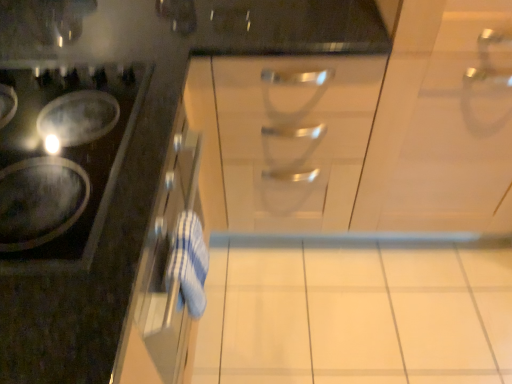
Question: Is shiny black cooktop at left to the left or to the right of white glossy cabinet at upper left, positioned as the first cabinetry in left-to-right order, in the image?

Choices:
 (A) right
 (B) left

Answer: (B)

Question: Is shiny black cooktop at left taller or shorter than white glossy cabinet at upper left, the 2th cabinetry when ordered from right to left?

Choices:
 (A) tall
 (B) short

Answer: (B)

Question: Estimate the real-world distances between objects in this image. Which object is farther from the satin silver drawer at center?

Choices:
 (A) white glossy tile at center
 (B) white glossy cabinet at center, which is the second cabinetry in left-to-right order
 (C) shiny black cooktop at left
 (D) white glossy cabinet at upper left, positioned as the first cabinetry in left-to-right order

Answer: (A)

Question: Based on their relative distances, which object is nearer to the satin silver drawer at center?

Choices:
 (A) white glossy tile at center
 (B) white glossy cabinet at upper left, positioned as the first cabinetry in left-to-right order
 (C) white glossy cabinet at center, the first cabinetry positioned from the right
 (D) shiny black cooktop at left

Answer: (C)